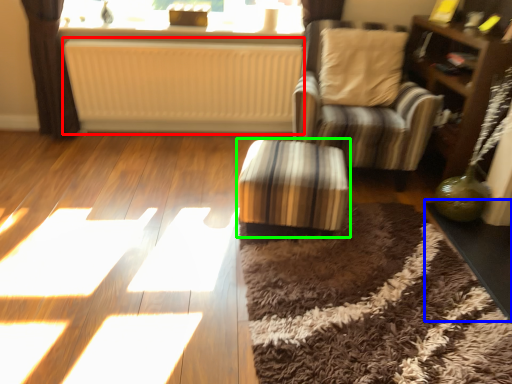
Question: Which object is the farthest from radiator (highlighted by a red box)? Choose among these: table (highlighted by a blue box) or table (highlighted by a green box).

Choices:
 (A) table
 (B) table

Answer: (A)